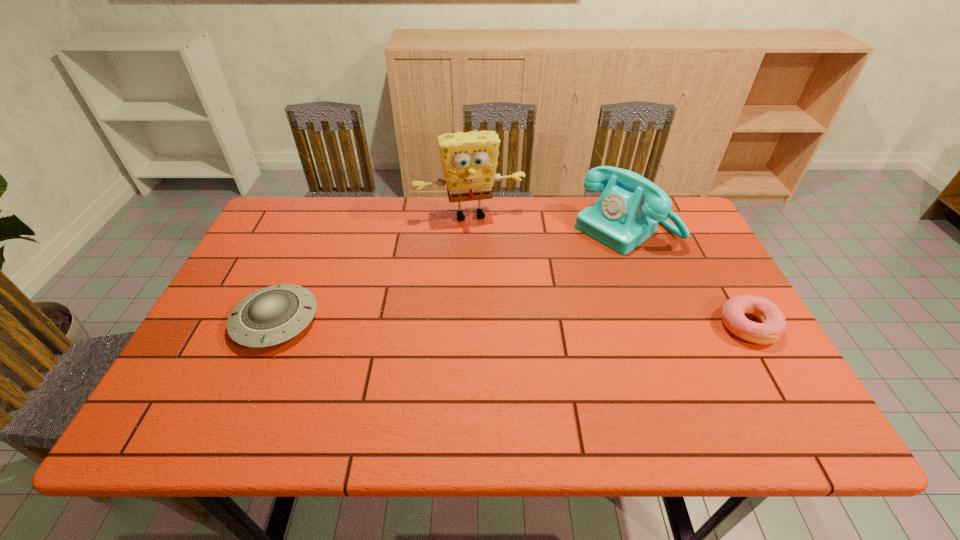
You are a GUI agent. You are given a task and a screenshot of the screen. Output one action in this format:
    pyautogui.click(x=<x>, y=<y>)
    Task: Click on the vacant space at the near edge
    
    Given the screenshot: What is the action you would take?
    pyautogui.click(x=692, y=366)

The image size is (960, 540). In order to click on free space at the right edge of the desktop in this screenshot , I will do `click(704, 266)`.

Identify the location of free location at the near left corner. (247, 378).

This screenshot has width=960, height=540. I want to click on free space at the far right corner of the desktop, so click(x=658, y=228).

This screenshot has width=960, height=540. I want to click on vacant space at the near right corner, so click(x=737, y=387).

Where is `vacant area that lies between the doughnut and the telephone`? The image size is (960, 540). vacant area that lies between the doughnut and the telephone is located at coordinates (686, 277).

Find the location of `vacant area that lies between the doughnut and the tallest object`. vacant area that lies between the doughnut and the tallest object is located at coordinates (609, 271).

You are a GUI agent. You are given a task and a screenshot of the screen. Output one action in this format:
    pyautogui.click(x=<x>, y=<y>)
    Task: Click on the vacant area between the telephone and the doughnut
    Image resolution: width=960 pixels, height=540 pixels.
    Given the screenshot: What is the action you would take?
    pyautogui.click(x=686, y=277)

This screenshot has height=540, width=960. Identify the location of empty space between the leftmost object and the telephone. (450, 274).

You are a GUI agent. You are given a task and a screenshot of the screen. Output one action in this format:
    pyautogui.click(x=<x>, y=<y>)
    Task: Click on the free spot between the second object from left to right and the telephone
    The width and height of the screenshot is (960, 540).
    Given the screenshot: What is the action you would take?
    pyautogui.click(x=547, y=222)